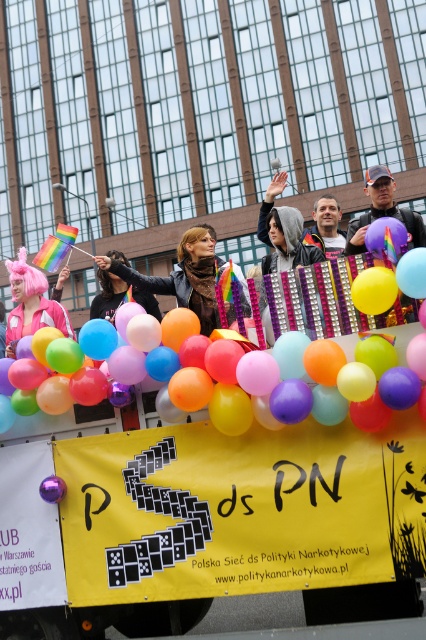
Question: Which object is closer to the camera taking this photo?

Choices:
 (A) matte black jacket at center
 (B) blonde synthetic wig at center

Answer: (A)

Question: Does pink hair at left come in front of shiny metallic jacket at center?

Choices:
 (A) yes
 (B) no

Answer: (A)

Question: Can you confirm if multicolored balloons at center is smaller than blonde synthetic wig at center?

Choices:
 (A) no
 (B) yes

Answer: (B)

Question: Can you confirm if colorful balloons at center is positioned to the right of pink fabric wig at upper center?

Choices:
 (A) yes
 (B) no

Answer: (A)

Question: Which point is farther to the camera?

Choices:
 (A) blonde synthetic wig at center
 (B) multicolored balloons at center
 (C) pink fabric wig at upper center
 (D) matte black jacket at center

Answer: (A)

Question: Which of the following is the closest to the observer?

Choices:
 (A) shiny metallic jacket at center
 (B) pink fabric wig at upper center

Answer: (A)